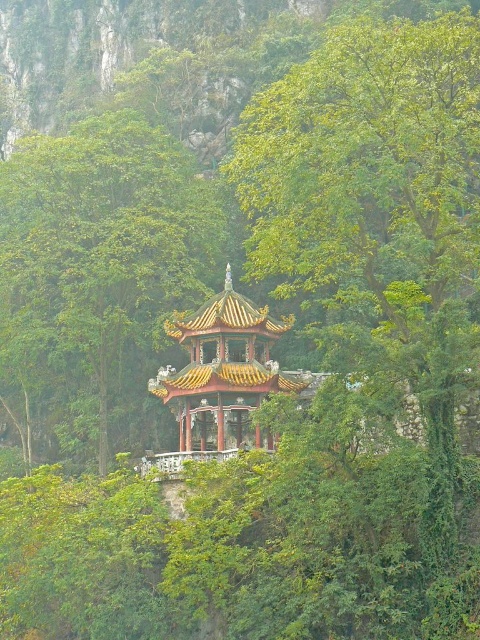
Question: Can you confirm if green leafy tree at center is positioned to the left of yellow/golden wood gazebo at center?

Choices:
 (A) yes
 (B) no

Answer: (A)

Question: Does green leafy tree at center have a larger size compared to yellow/golden wood gazebo at center?

Choices:
 (A) yes
 (B) no

Answer: (A)

Question: Among these objects, which one is nearest to the camera?

Choices:
 (A) yellow/golden wood gazebo at center
 (B) green leafy tree at center

Answer: (A)

Question: Can you confirm if green leafy tree at center is bigger than yellow/golden wood gazebo at center?

Choices:
 (A) no
 (B) yes

Answer: (B)

Question: Which point is farther to the camera?

Choices:
 (A) green leafy tree at center
 (B) yellow/golden wood gazebo at center

Answer: (A)